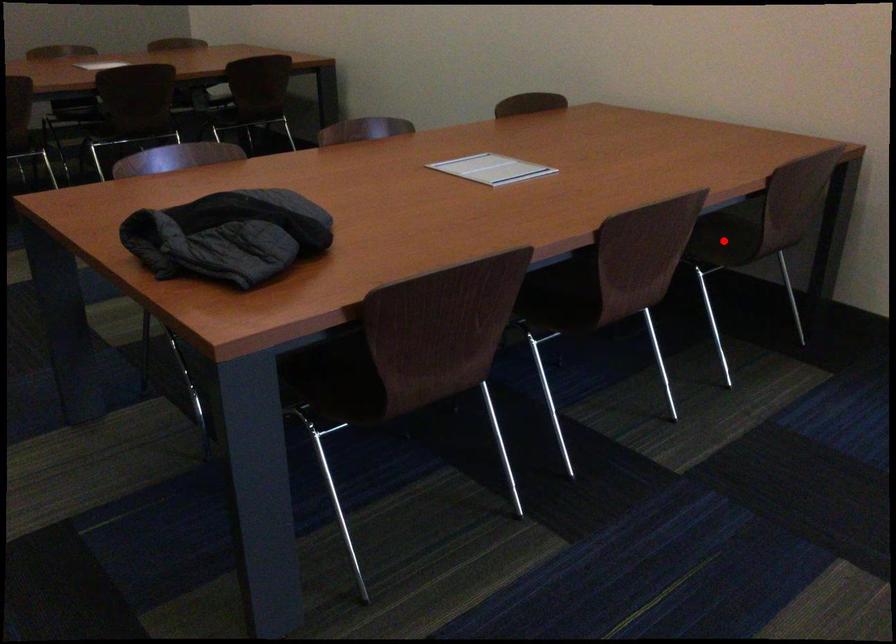
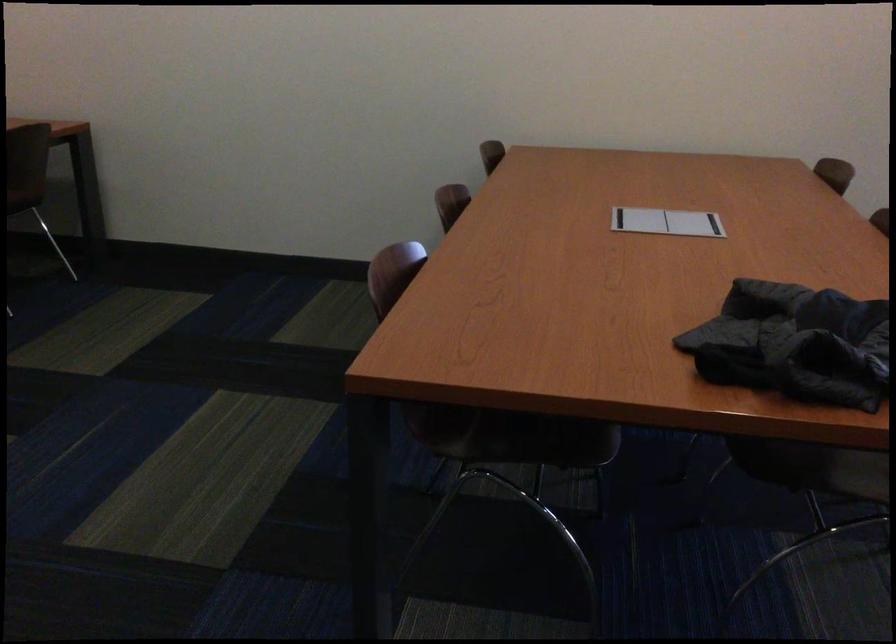
Question: I am providing you with two images of the same scene from different viewpoints. A red point is marked on the first image. At the location where the point appears in image 1, is it still visible in image 2?

Choices:
 (A) Yes
 (B) No

Answer: (B)